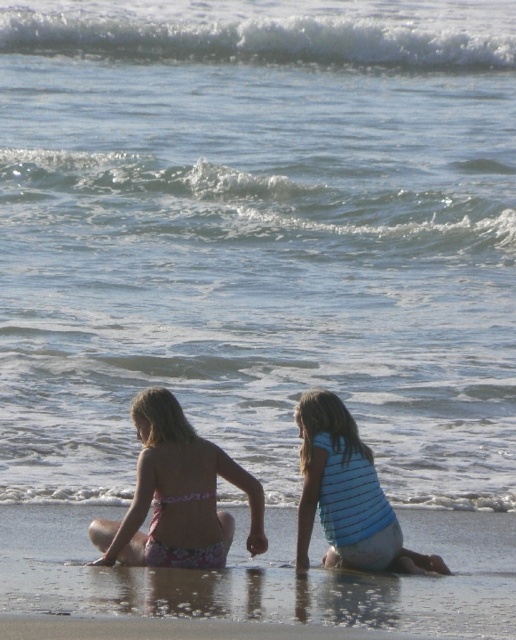
You are standing at the center of the image and want to locate the pink floral swimsuit at lower left. Which direction should you look to find it?

You should look to the lower left direction to find the pink floral swimsuit at lower left, as it is located at point (176, 496).

You are standing at the origin point of the coordinate system in this image. You want to throw a seashell towards the point at point [414,600] and point [347,484]. Which point should you aim for if you want the seashell to land closer to the ocean waves?

Point [414,600] is in front of point [347,484], so you should aim for point [414,600] to land closer to the ocean waves.

You are a photographer trying to capture a shot of the smooth sand at lower center and the pink floral swimsuit at lower left. Since you want to focus on the sand, where should you position the swimsuit relative to the sand?

The smooth sand at lower center is positioned under the pink floral swimsuit at lower left, so to focus on the sand, you should position the swimsuit above it.